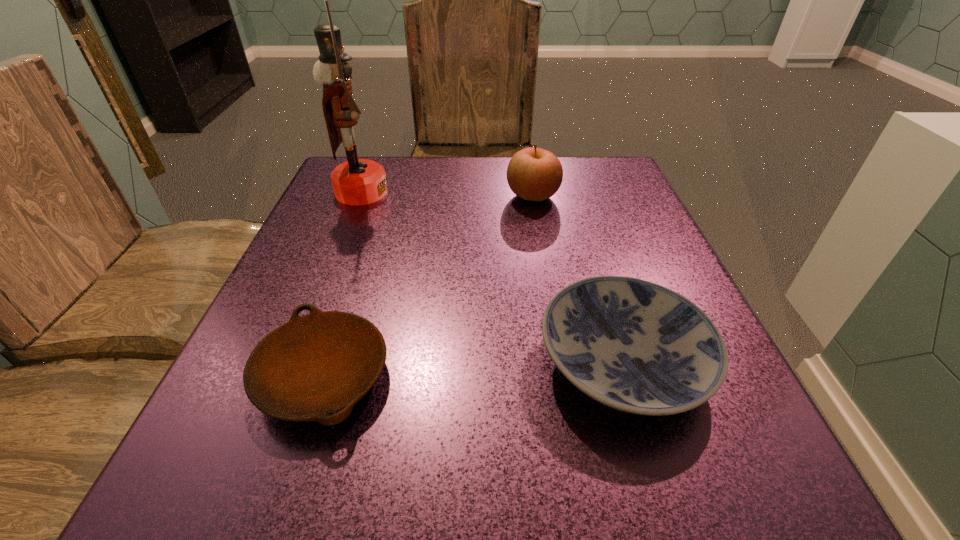
You are a GUI agent. You are given a task and a screenshot of the screen. Output one action in this format:
    pyautogui.click(x=<x>, y=<y>)
    Task: Click on the nutcracker
    
    Given the screenshot: What is the action you would take?
    pyautogui.click(x=357, y=181)

Find the location of `apple`. apple is located at coordinates (534, 174).

Locate an element on the screen. the taller plate is located at coordinates (636, 346).

The width and height of the screenshot is (960, 540). Find the location of `the right plate`. the right plate is located at coordinates (636, 346).

Find the location of a particular element. the shorter plate is located at coordinates (316, 367).

Find the location of `the shortest object`. the shortest object is located at coordinates (316, 367).

The height and width of the screenshot is (540, 960). I want to click on vacant area situated on the front-facing side of the tallest object, so click(x=454, y=192).

Identify the location of vacant space located 0.120m on the left of the apple. (451, 196).

At what (x,y) coordinates should I click in order to perform the action: click on free space located on the left of the right plate. Please return your answer as a coordinate pair (x, y). This screenshot has height=540, width=960. Looking at the image, I should click on tap(350, 362).

The image size is (960, 540). Find the location of `vacant area located 0.380m on the right of the shorter plate`. vacant area located 0.380m on the right of the shorter plate is located at coordinates (661, 376).